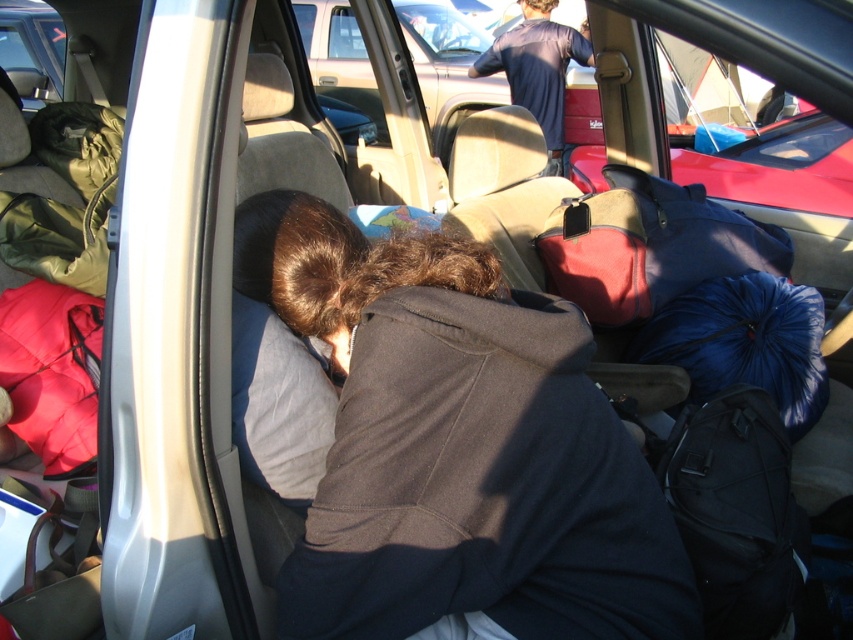
Question: Is dark gray hoodie at center to the left of blue synthetic sleeping bag at center-right from the viewer's perspective?

Choices:
 (A) no
 (B) yes

Answer: (B)

Question: Which object appears closest to the camera in this image?

Choices:
 (A) dark gray hoodie at center
 (B) blue synthetic sleeping bag at center-right

Answer: (A)

Question: Which point is closer to the camera?

Choices:
 (A) (735, 211)
 (B) (558, 86)

Answer: (A)

Question: Is the position of dark gray hoodie at center more distant than that of blue synthetic sleeping bag at center-right?

Choices:
 (A) no
 (B) yes

Answer: (A)

Question: Which point is farther to the camera?

Choices:
 (A) dark blue t-shirt at upper center
 (B) dark gray hoodie at center
 (C) blue synthetic sleeping bag at center-right

Answer: (A)

Question: Is dark gray hoodie at center smaller than blue synthetic sleeping bag at center-right?

Choices:
 (A) yes
 (B) no

Answer: (B)